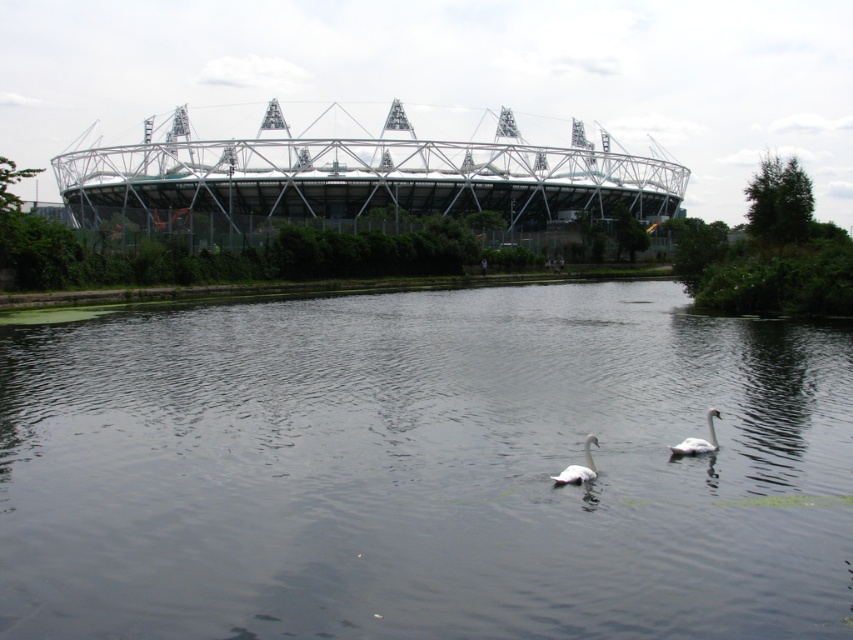
Is transparent water at center positioned behind white matte swan at lower center?

No.

Which is in front, point (268, 388) or point (683, 451)?

Point (683, 451)

At what (x,y) coordinates should I click in order to perform the action: click on transparent water at center. Please return your answer as a coordinate pair (x, y). Image resolution: width=853 pixels, height=640 pixels. Looking at the image, I should click on (425, 468).

Identify the location of transparent water at center. (425, 468).

Is white feathered swan at center to the right of white matte swan at lower center from the viewer's perspective?

No, white feathered swan at center is not to the right of white matte swan at lower center.

Can you confirm if white feathered swan at center is wider than white matte swan at lower center?

No, white feathered swan at center is not wider than white matte swan at lower center.

Between point (550, 476) and point (704, 440), which one is positioned behind?

Positioned behind is point (704, 440).

Identify the location of white feathered swan at center. The height and width of the screenshot is (640, 853). [x=578, y=467].

Is point (838, 467) closer to viewer compared to point (583, 444)?

Yes, point (838, 467) is in front of point (583, 444).

Does transparent water at center appear on the right side of white feathered swan at center?

Indeed, transparent water at center is positioned on the right side of white feathered swan at center.

Is point (57, 598) behind point (578, 476)?

No.

The width and height of the screenshot is (853, 640). I want to click on transparent water at center, so click(x=425, y=468).